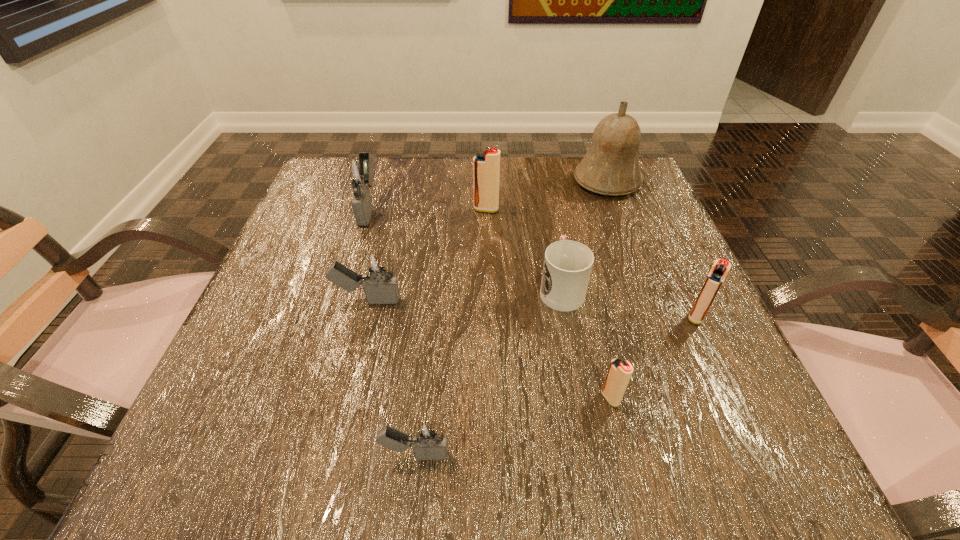
The image size is (960, 540). I want to click on vacant space that satisfies the following two spatial constraints: 1. on the front side of the tallest object; 2. on the right side of the rightmost igniter, so click(659, 316).

Where is `free space in the image that satisfies the following two spatial constraints: 1. on the front side of the third igniter from right to left; 2. on the left side of the biggest gray igniter`? This screenshot has width=960, height=540. free space in the image that satisfies the following two spatial constraints: 1. on the front side of the third igniter from right to left; 2. on the left side of the biggest gray igniter is located at coordinates (369, 210).